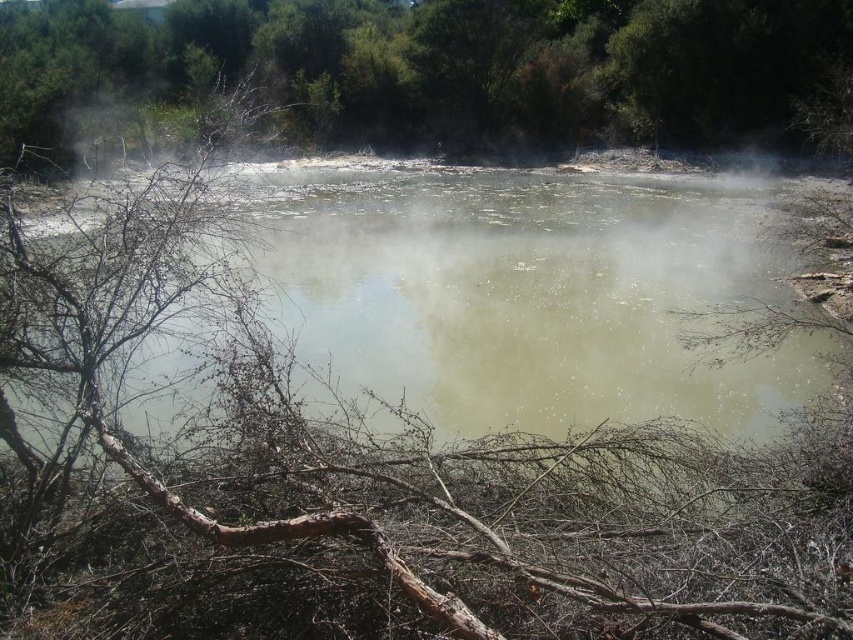
Question: Is green murky water at center below green leafy tree at upper center?

Choices:
 (A) yes
 (B) no

Answer: (A)

Question: Among these objects, which one is nearest to the camera?

Choices:
 (A) green leafy tree at upper center
 (B) green murky water at center

Answer: (B)

Question: Is green murky water at center behind green leafy tree at upper center?

Choices:
 (A) yes
 (B) no

Answer: (B)

Question: Is the position of green murky water at center less distant than that of green leafy tree at upper center?

Choices:
 (A) no
 (B) yes

Answer: (B)